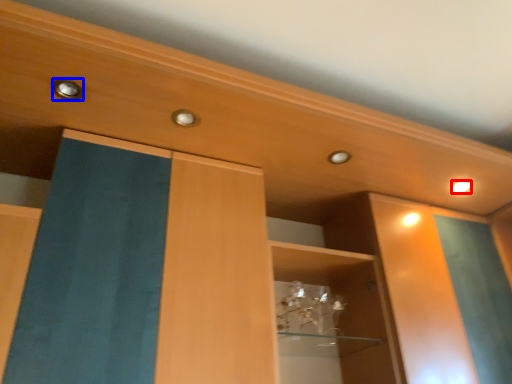
Question: Among these objects, which one is nearest to the camera, lighting (highlighted by a red box) or knob (highlighted by a blue box)?

Choices:
 (A) lighting
 (B) knob

Answer: (B)